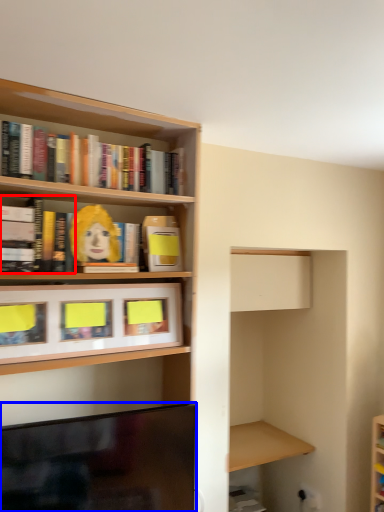
Question: Which of the following is the closest to the observer, book (highlighted by a red box) or television (highlighted by a blue box)?

Choices:
 (A) book
 (B) television

Answer: (B)